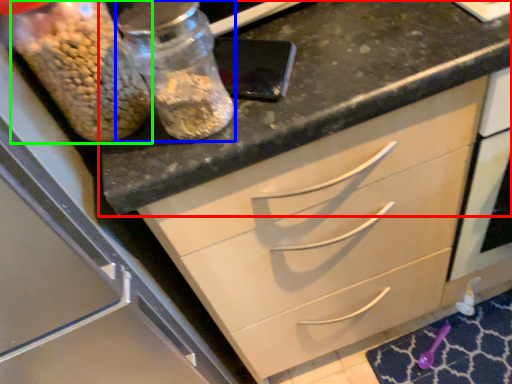
Question: Which is farther away from countertop (highlighted by a red box)? glass jar (highlighted by a blue box) or food (highlighted by a green box)?

Choices:
 (A) glass jar
 (B) food

Answer: (B)